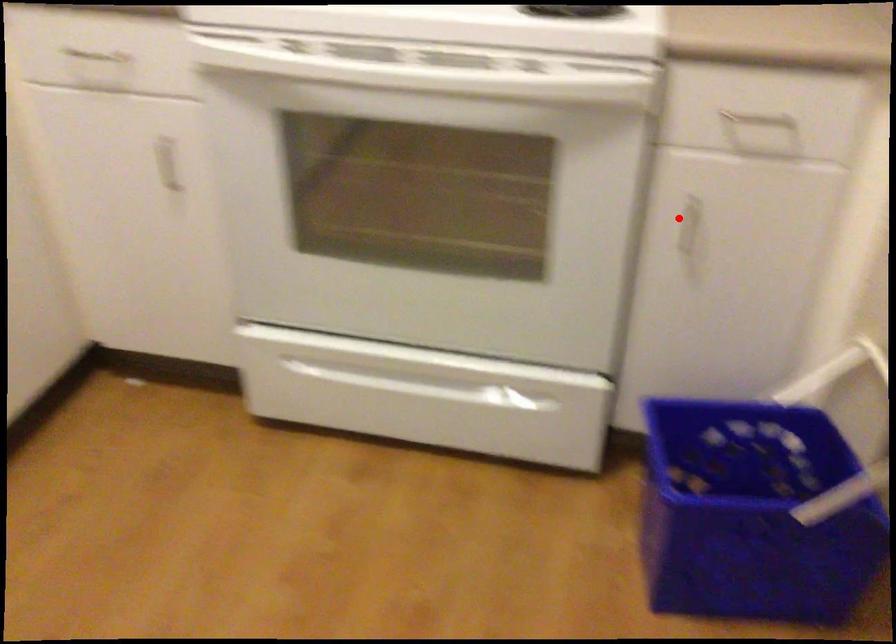
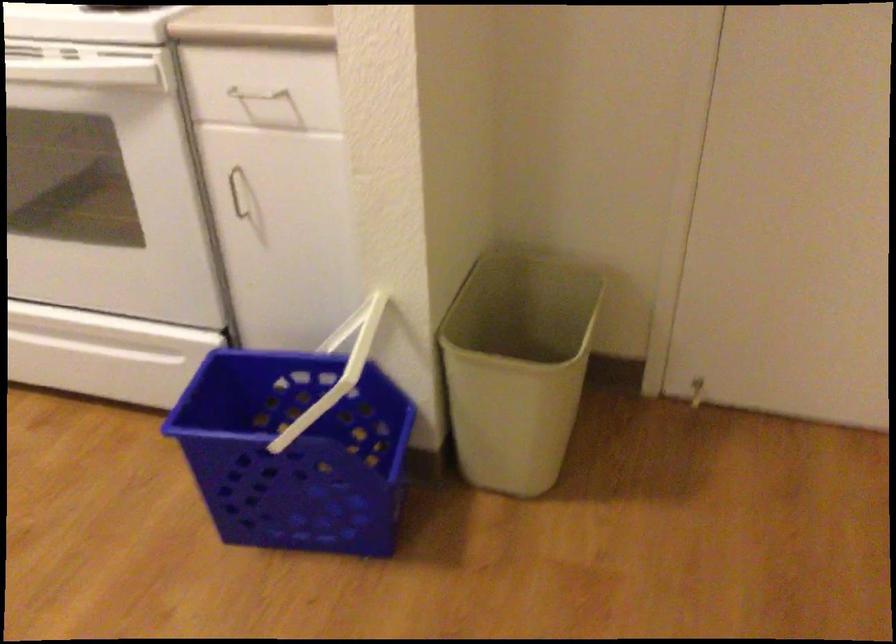
Find the pixel in the second image that matches the highlighted location in the first image.

(237, 192)